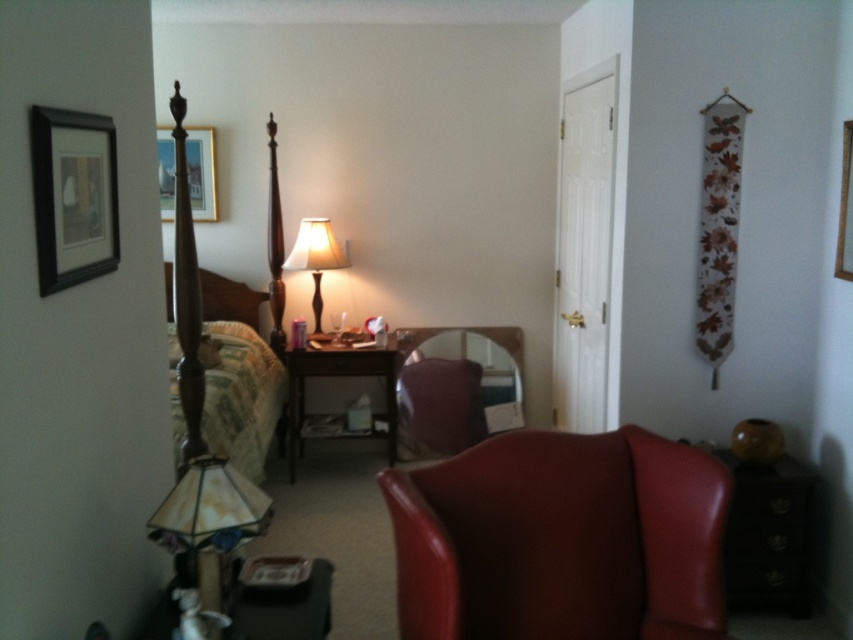
Does wooden bed at left come in front of wooden picture frame at upper right?

Yes, wooden bed at left is in front of wooden picture frame at upper right.

Can you confirm if wooden bed at left is shorter than wooden picture frame at upper right?

No, wooden bed at left is not shorter than wooden picture frame at upper right.

Measure the distance between wooden bed at left and camera.

8.37 feet

This screenshot has height=640, width=853. Find the location of `wooden bed at left`. wooden bed at left is located at coordinates (225, 356).

The width and height of the screenshot is (853, 640). Find the location of `leather armchair at center`. leather armchair at center is located at coordinates (561, 540).

Which is more to the left, leather armchair at center or velvet brown armchair at center?

Positioned to the left is velvet brown armchair at center.

Image resolution: width=853 pixels, height=640 pixels. I want to click on leather armchair at center, so coord(561,540).

Is point (184, 532) positioned behind point (292, 250)?

No, (184, 532) is closer to viewer.

Consider the image. Who is positioned more to the left, stained glass lampshade at lower left or matte glass lamp at center?

matte glass lamp at center

Between point (209, 570) and point (309, 227), which one is positioned in front?

Point (209, 570)

Locate an element on the screen. Image resolution: width=853 pixels, height=640 pixels. stained glass lampshade at lower left is located at coordinates (207, 524).